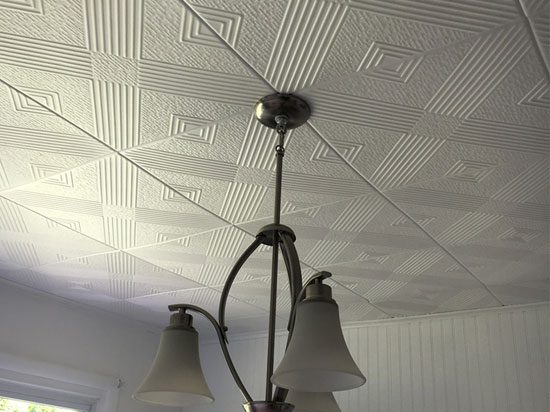
Identify the location of hook. (280, 147).